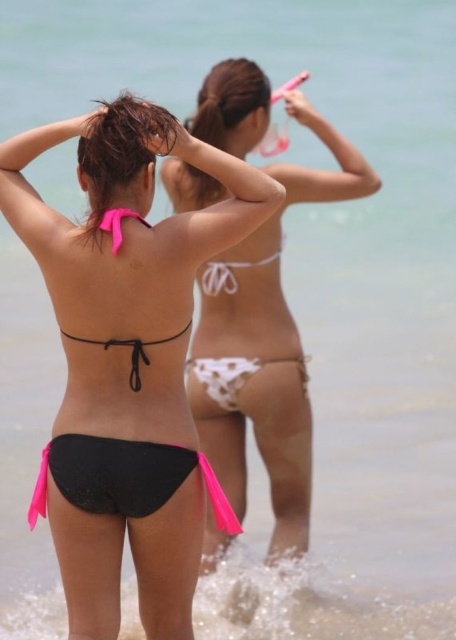
Based on the scene description, where is the white polka dot bikini at center positioned in relation to the other elements in the image?

The white polka dot bikini at center is located at point coordinates of 0.586 on the x axis and 0.518 on the y axis.

You are a photographer trying to capture a clear shot of both the white matte bikini bottom at center and the white polka dot bikini at center. Since you want to ensure both are visible, which one should you focus on first to account for their size differences?

The white matte bikini bottom at center is taller than the white polka dot bikini at center, so you should focus on the white matte bikini bottom at center first to ensure its details are captured clearly before adjusting for the smaller one.

You are a photographer trying to capture a clear shot of both the white matte bikini bottom at center and the pink satin bikini top at upper center. However, you notice that one of them is blocking the view of the other. Which one is blocking the other?

The pink satin bikini top at upper center is behind the white matte bikini bottom at center, so the white matte bikini bottom at center is blocking the view of the pink satin bikini top at upper center.